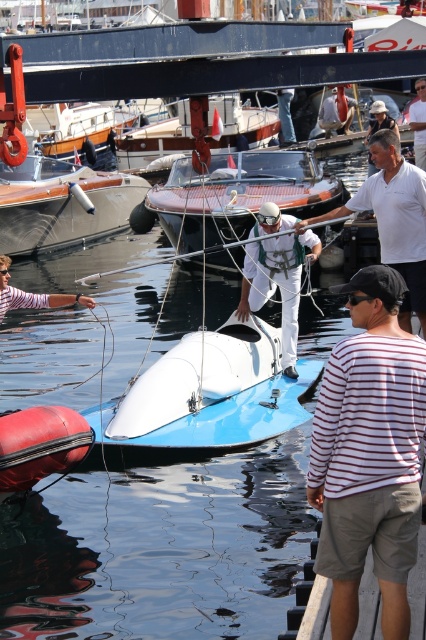
Question: Is striped cotton shirt at lower right further to camera compared to white matte shirt at center?

Choices:
 (A) no
 (B) yes

Answer: (A)

Question: Which point is farther from the camera taking this photo?

Choices:
 (A) (207, 422)
 (B) (388, 154)
 (C) (333, 106)

Answer: (C)

Question: Estimate the real-world distances between objects in this image. Which object is farther from the white fabric helmet at center?

Choices:
 (A) white cotton shirt at upper right
 (B) white matte shirt at center
 (C) white glossy boat at center

Answer: (A)

Question: Is striped cotton shirt at lower right further to camera compared to shiny white boat at center?

Choices:
 (A) yes
 (B) no

Answer: (B)

Question: Is white glossy speedboat at center positioned in front of white cotton shirt at upper right?

Choices:
 (A) yes
 (B) no

Answer: (A)

Question: Estimate the real-world distances between objects in this image. Which object is closer to the striped cotton shirt at lower right?

Choices:
 (A) white glossy boat at center
 (B) white cotton shirt at upper right

Answer: (A)